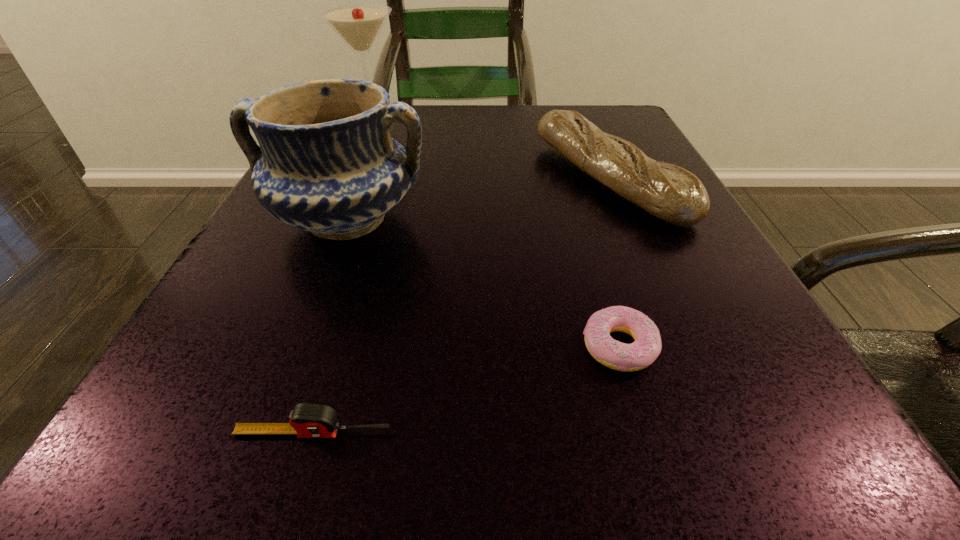
I want to click on free region located on the back of the fourth tallest object, so click(x=374, y=231).

The width and height of the screenshot is (960, 540). What are the coordinates of `free spot located on the back of the doughnut` in the screenshot? It's located at (590, 249).

Locate an element on the screen. martini that is at the far edge is located at coordinates (359, 24).

Find the location of `baguet at the far edge`. baguet at the far edge is located at coordinates (674, 195).

Where is `object that is at the near edge`? This screenshot has height=540, width=960. object that is at the near edge is located at coordinates (307, 420).

Locate an element on the screen. This screenshot has width=960, height=540. martini at the left edge is located at coordinates (359, 24).

Image resolution: width=960 pixels, height=540 pixels. Find the location of `pottery that is at the left edge`. pottery that is at the left edge is located at coordinates (327, 164).

At what (x,y) coordinates should I click in order to perform the action: click on tape measure that is at the left edge. Please return your answer as a coordinate pair (x, y). The width and height of the screenshot is (960, 540). Looking at the image, I should click on (307, 420).

At what (x,y) coordinates should I click in order to perform the action: click on baguet present at the right edge. Please return your answer as a coordinate pair (x, y). The width and height of the screenshot is (960, 540). Looking at the image, I should click on (674, 195).

I want to click on doughnut that is at the right edge, so click(x=647, y=345).